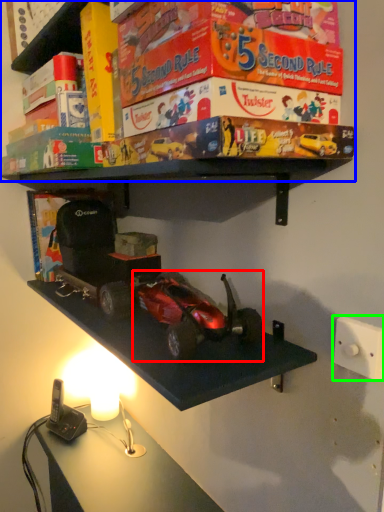
Question: Which object is positioned closest to model car (highlighted by a red box)? Select from shelf (highlighted by a blue box) and light switch (highlighted by a green box).

Choices:
 (A) shelf
 (B) light switch

Answer: (B)